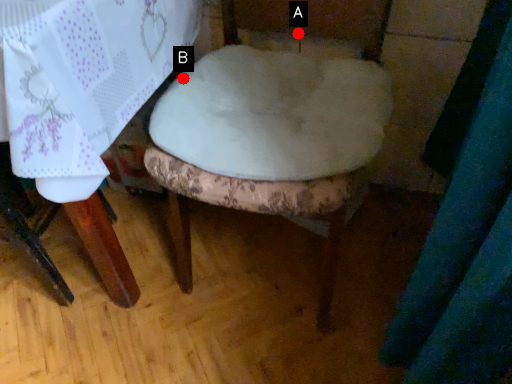
Question: Two points are circled on the image, labeled by A and B beside each circle. Which point is further to the camera?

Choices:
 (A) A is further
 (B) B is further

Answer: (A)